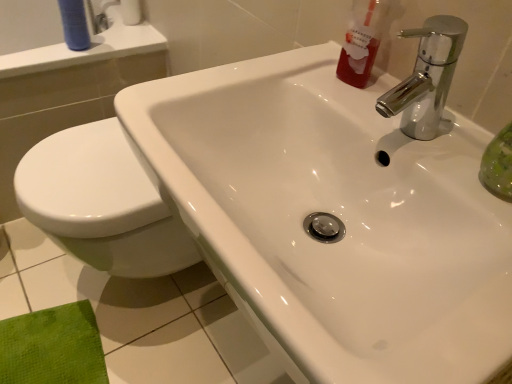
Question: Should I look upward or downward to see blue matte tube at upper left?

Choices:
 (A) down
 (B) up

Answer: (B)

Question: Does chrome metallic faucet at upper right contain blue matte tube at upper left?

Choices:
 (A) yes
 (B) no

Answer: (B)

Question: Is chrome metallic faucet at upper right to the right of blue matte tube at upper left from the viewer's perspective?

Choices:
 (A) no
 (B) yes

Answer: (B)

Question: From the image's perspective, is chrome metallic faucet at upper right below blue matte tube at upper left?

Choices:
 (A) yes
 (B) no

Answer: (A)

Question: Is chrome metallic faucet at upper right further to the viewer compared to blue matte tube at upper left?

Choices:
 (A) no
 (B) yes

Answer: (A)

Question: Is chrome metallic faucet at upper right to the left of blue matte tube at upper left from the viewer's perspective?

Choices:
 (A) yes
 (B) no

Answer: (B)

Question: Considering the relative sizes of chrome metallic faucet at upper right and blue matte tube at upper left in the image provided, is chrome metallic faucet at upper right taller than blue matte tube at upper left?

Choices:
 (A) no
 (B) yes

Answer: (A)

Question: Considering the relative sizes of blue matte tube at upper left and chrome metallic faucet at upper right in the image provided, is blue matte tube at upper left thinner than chrome metallic faucet at upper right?

Choices:
 (A) no
 (B) yes

Answer: (B)

Question: Is the depth of blue matte tube at upper left less than that of chrome metallic faucet at upper right?

Choices:
 (A) yes
 (B) no

Answer: (B)

Question: Can you confirm if blue matte tube at upper left is positioned to the left of chrome metallic faucet at upper right?

Choices:
 (A) yes
 (B) no

Answer: (A)

Question: Would you consider blue matte tube at upper left to be distant from chrome metallic faucet at upper right?

Choices:
 (A) yes
 (B) no

Answer: (B)

Question: From a real-world perspective, does blue matte tube at upper left stand above chrome metallic faucet at upper right?

Choices:
 (A) no
 (B) yes

Answer: (A)

Question: Would you say blue matte tube at upper left contains chrome metallic faucet at upper right?

Choices:
 (A) yes
 (B) no

Answer: (B)

Question: Can you confirm if blue matte tube at upper left is wider than translucent red liquid at upper right?

Choices:
 (A) no
 (B) yes

Answer: (A)